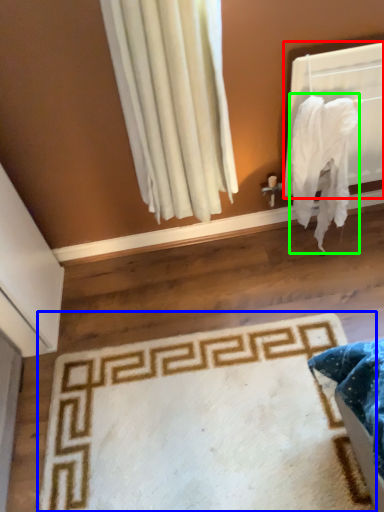
Question: Which object is the closest to the window screen (highlighted by a red box)? Choose among these: mat (highlighted by a blue box) or blanket (highlighted by a green box).

Choices:
 (A) mat
 (B) blanket

Answer: (B)